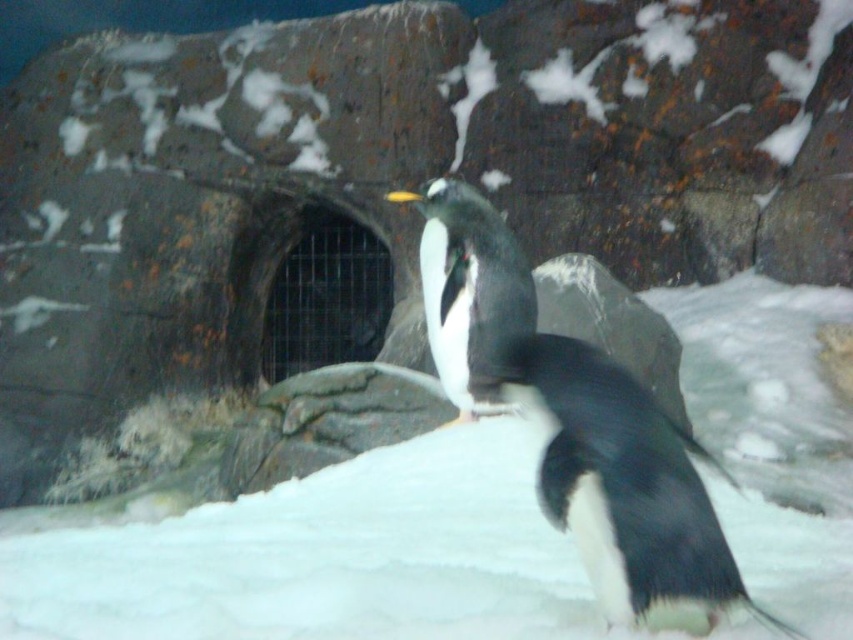
Based on the photo, is white fluffy snow at center to the right of black matte penguin at center from the viewer's perspective?

Yes, white fluffy snow at center is to the right of black matte penguin at center.

This screenshot has width=853, height=640. Describe the element at coordinates (318, 557) in the screenshot. I see `white fluffy snow at center` at that location.

Locate an element on the screen. white fluffy snow at center is located at coordinates tap(318, 557).

Find the location of a particular element. The width and height of the screenshot is (853, 640). white fluffy snow at center is located at coordinates tap(318, 557).

Who is more distant from viewer, (97, 616) or (438, 312)?

The point (438, 312) is more distant.

You are a GUI agent. You are given a task and a screenshot of the screen. Output one action in this format:
    pyautogui.click(x=<x>, y=<y>)
    Task: Click on the white fluffy snow at center
    Image resolution: width=853 pixels, height=640 pixels.
    Given the screenshot: What is the action you would take?
    pyautogui.click(x=318, y=557)

Can you confirm if black matte penguin at center is positioned above white matte penguin at center?

Correct, black matte penguin at center is located above white matte penguin at center.

Does point (589, 525) lie behind point (437, 236)?

No, it is in front of (437, 236).

Which is behind, point (625, 593) or point (502, 292)?

Positioned behind is point (502, 292).

Find the location of a particular element. This screenshot has width=853, height=640. black matte penguin at center is located at coordinates (573, 422).